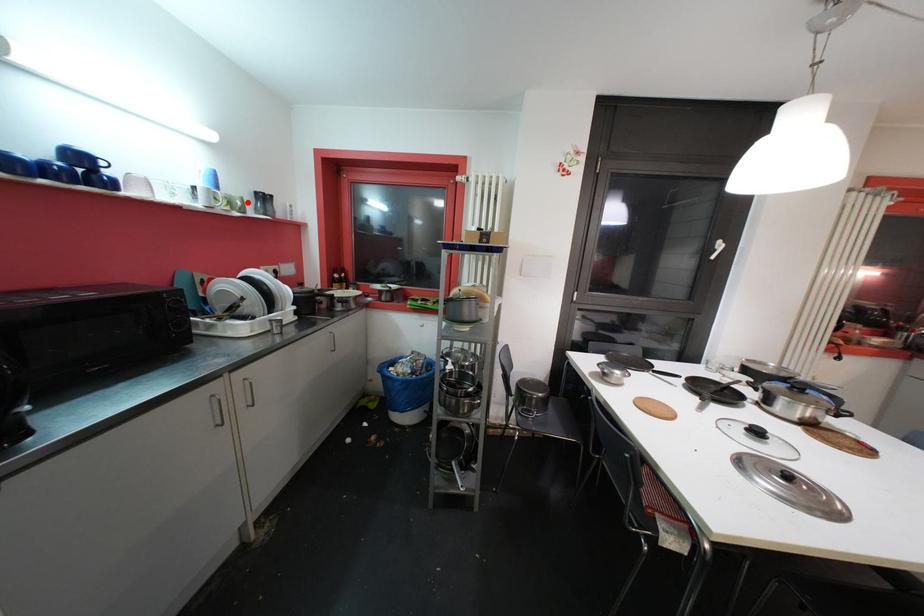
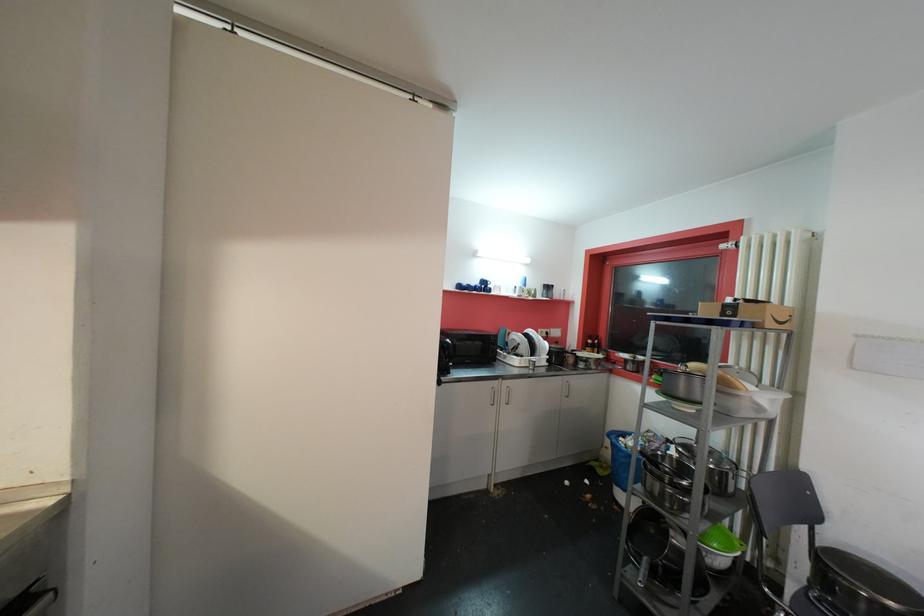
Where in the second image is the point corresponding to the highlighted location from the first image?

(541, 293)